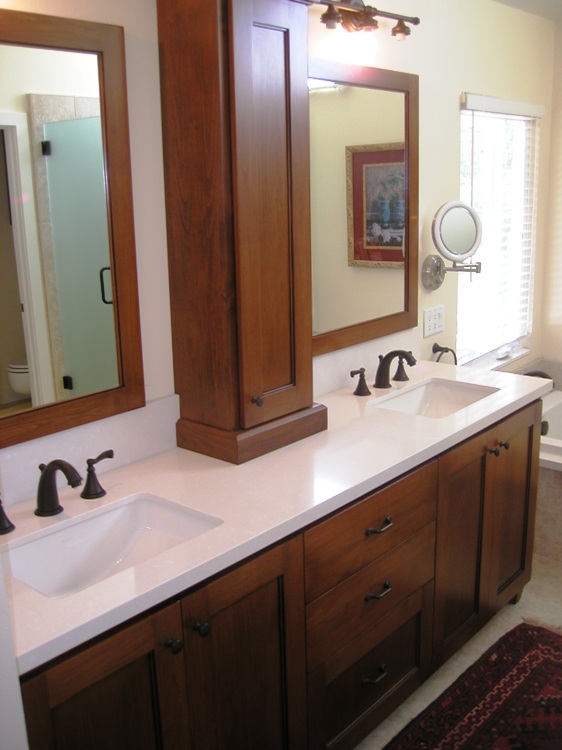
This screenshot has width=562, height=750. I want to click on counter, so click(x=306, y=484).